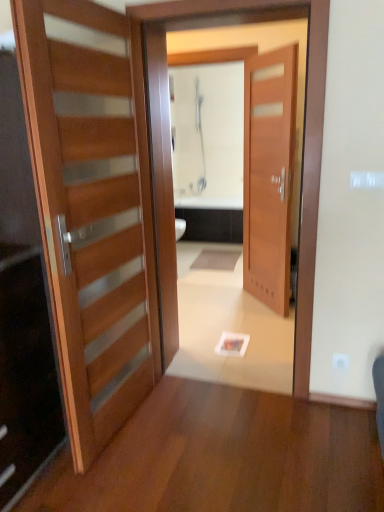
Where is `vacant area located to the right-hand side of wooden door at left, which is the 2th door from back to front`? The width and height of the screenshot is (384, 512). vacant area located to the right-hand side of wooden door at left, which is the 2th door from back to front is located at coordinates (204, 423).